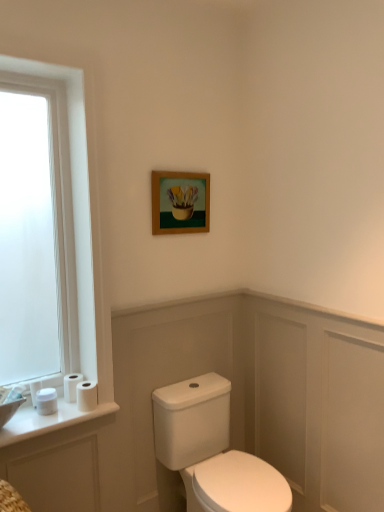
The height and width of the screenshot is (512, 384). In order to click on free point above white glossy counter top at lower left (from a real-world perspective) in this screenshot , I will do `click(66, 407)`.